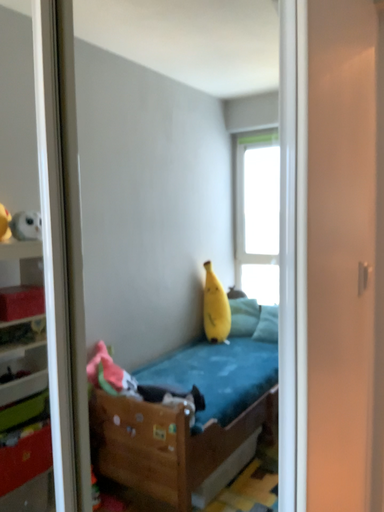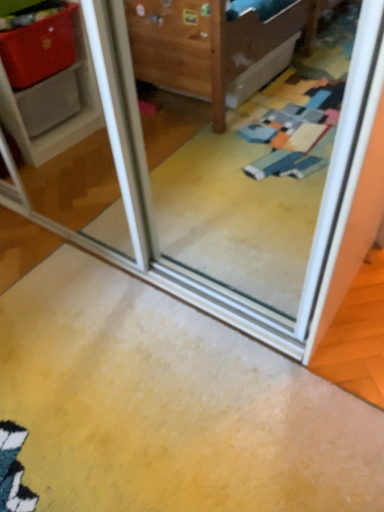
Question: Which way did the camera rotate in the video?

Choices:
 (A) rotated upward
 (B) rotated downward

Answer: (B)